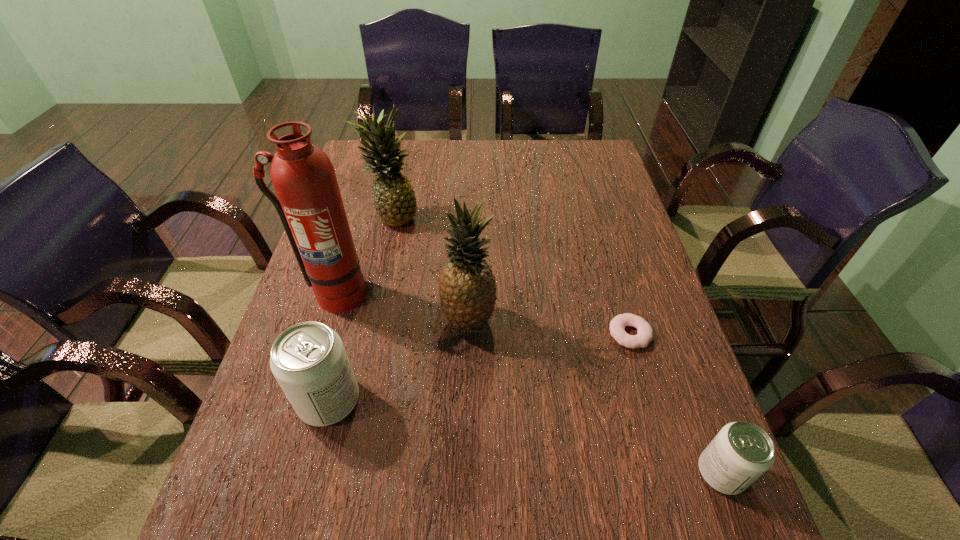
The width and height of the screenshot is (960, 540). Find the location of `free space between the shorter soda can and the fire extinguisher`. free space between the shorter soda can and the fire extinguisher is located at coordinates (528, 383).

What are the coordinates of `vacant space that is in between the right pineapple and the fire extinguisher` in the screenshot? It's located at (401, 307).

At what (x,y) coordinates should I click in order to perform the action: click on unoccupied area between the left pineapple and the fifth object from left to right. Please return your answer as a coordinate pair (x, y). This screenshot has height=540, width=960. Looking at the image, I should click on (512, 274).

The image size is (960, 540). Identify the location of vacant area that lies between the fourth tallest object and the nearer pineapple. (398, 361).

Locate an element on the screen. This screenshot has height=540, width=960. blank region between the tallest object and the left pineapple is located at coordinates (365, 254).

Where is `free spot between the left soda can and the doughnut`? The width and height of the screenshot is (960, 540). free spot between the left soda can and the doughnut is located at coordinates (480, 367).

I want to click on free space between the farthest object and the fourth object from left to right, so click(x=431, y=268).

What are the coordinates of `free point between the fire extinguisher and the rightmost object` in the screenshot? It's located at (528, 383).

Select which object is the fifth closest to the tallest object. Please provide its 2D coordinates. Your answer should be formatted as a tuple, i.e. [(x, y)], where the tuple contains the x and y coordinates of a point satisfying the conditions above.

[(741, 452)]

Identify which object is the second closest to the fire extinguisher. Please provide its 2D coordinates. Your answer should be formatted as a tuple, i.e. [(x, y)], where the tuple contains the x and y coordinates of a point satisfying the conditions above.

[(394, 200)]